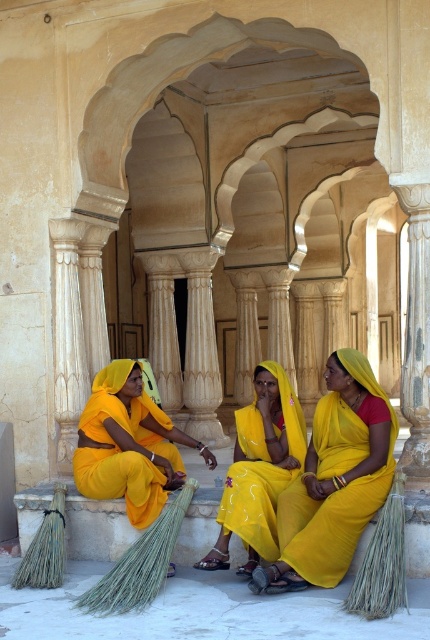
You are a photographer planning to capture a group photo of the three women in the scene. You need to ensure that the woman wearing the yellow silk saree at center and the woman in the matte yellow sari at lower left are both in the frame. Based on their positions, which woman should you position closer to the left side of the camera frame to maintain their original spatial arrangement?

The matte yellow sari at lower left should be positioned closer to the left side of the camera frame because the yellow silk saree at center is on the right side of the matte yellow sari at lower left in the original scene.